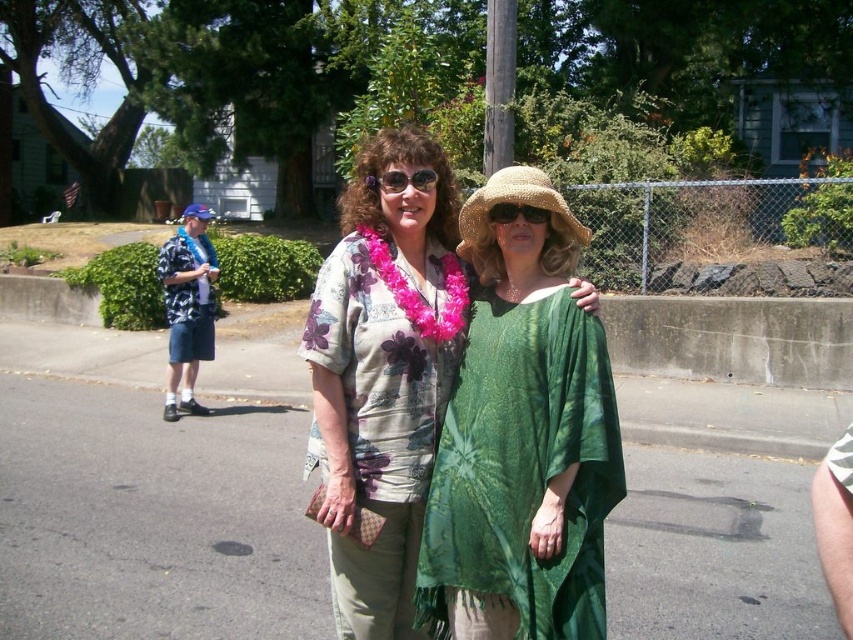
Question: Does floral print blouse at center lie in front of sunglassesbrown at center?

Choices:
 (A) no
 (B) yes

Answer: (A)

Question: Which object appears closest to the camera in this image?

Choices:
 (A) hawaiian print fabric shirt at left
 (B) green tie-dye dress at center
 (C) green silky robe at center
 (D) matte black sunglasses at center

Answer: (B)

Question: Estimate the real-world distances between objects in this image. Which object is closer to the green tie-dye dress at center?

Choices:
 (A) hawaiian print fabric shirt at left
 (B) matte black sunglasses at center
 (C) floral print blouse at center
 (D) sunglassesbrown at center

Answer: (C)

Question: Can you confirm if floral print blouse at center is positioned to the left of green silky robe at center?

Choices:
 (A) no
 (B) yes

Answer: (B)

Question: Does green silky robe at center appear on the left side of sunglassesbrown at center?

Choices:
 (A) no
 (B) yes

Answer: (B)

Question: Which object is positioned farthest from the green tie-dye dress at center?

Choices:
 (A) green silky robe at center
 (B) matte black sunglasses at center

Answer: (B)